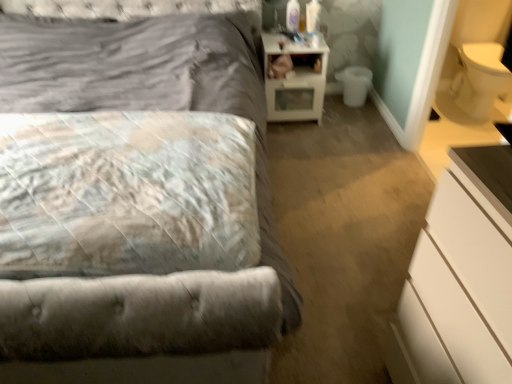
Question: In terms of width, does velvet gray bed at center look wider or thinner when compared to white glossy nightstand at upper right?

Choices:
 (A) wide
 (B) thin

Answer: (A)

Question: From the image's perspective, is velvet gray bed at center positioned above or below white glossy nightstand at upper right?

Choices:
 (A) above
 (B) below

Answer: (B)

Question: Which object is positioned farthest from the fluffy white pillow at left?

Choices:
 (A) velvet gray bed at center
 (B) white glossy nightstand at upper right
 (C) white matte chest of drawers at lower right
 (D) white plastic toilet bowl at lower right

Answer: (D)

Question: Which of these objects is positioned farthest from the white glossy nightstand at upper right?

Choices:
 (A) white matte chest of drawers at lower right
 (B) white plastic toilet bowl at lower right
 (C) velvet gray bed at center
 (D) fluffy white pillow at left

Answer: (A)